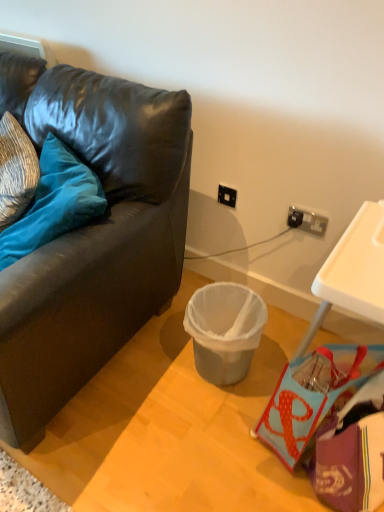
Question: Is velvet blue pillow at left far away from gray plastic trash can at center?

Choices:
 (A) no
 (B) yes

Answer: (A)

Question: From a real-world perspective, is velvet blue pillow at left below gray plastic trash can at center?

Choices:
 (A) no
 (B) yes

Answer: (A)

Question: Is velvet blue pillow at left behind gray plastic trash can at center?

Choices:
 (A) yes
 (B) no

Answer: (B)

Question: Considering the relative positions of velvet blue pillow at left and gray plastic trash can at center in the image provided, is velvet blue pillow at left in front of gray plastic trash can at center?

Choices:
 (A) yes
 (B) no

Answer: (A)

Question: Is gray plastic trash can at center located within velvet blue pillow at left?

Choices:
 (A) no
 (B) yes

Answer: (A)

Question: Do you think purple fabric handbag at lower right is within matte black couch at lower left, or outside of it?

Choices:
 (A) outside
 (B) inside

Answer: (A)

Question: From a real-world perspective, is purple fabric handbag at lower right above or below matte black couch at lower left?

Choices:
 (A) below
 (B) above

Answer: (A)

Question: Relative to matte black couch at lower left, is purple fabric handbag at lower right in front or behind?

Choices:
 (A) front
 (B) behind

Answer: (B)

Question: Is purple fabric handbag at lower right wider or thinner than matte black couch at lower left?

Choices:
 (A) thin
 (B) wide

Answer: (A)

Question: Would you say gray plastic trash can at center is to the left or to the right of matte black couch at lower left in the picture?

Choices:
 (A) right
 (B) left

Answer: (A)

Question: Is gray plastic trash can at center spatially inside matte black couch at lower left, or outside of it?

Choices:
 (A) outside
 (B) inside

Answer: (A)

Question: Considering the positions of gray plastic trash can at center and matte black couch at lower left in the image, is gray plastic trash can at center taller or shorter than matte black couch at lower left?

Choices:
 (A) short
 (B) tall

Answer: (A)

Question: From the image's perspective, is gray plastic trash can at center located above or below matte black couch at lower left?

Choices:
 (A) above
 (B) below

Answer: (B)

Question: From the image's perspective, is matte black couch at lower left above or below velvet blue pillow at left?

Choices:
 (A) below
 (B) above

Answer: (A)

Question: Is matte black couch at lower left wider or thinner than velvet blue pillow at left?

Choices:
 (A) thin
 (B) wide

Answer: (B)